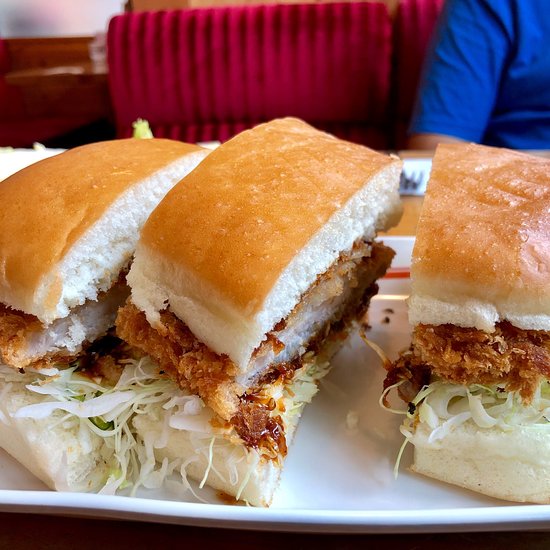
Identify the location of tabletop. The width and height of the screenshot is (550, 550). (410, 218).